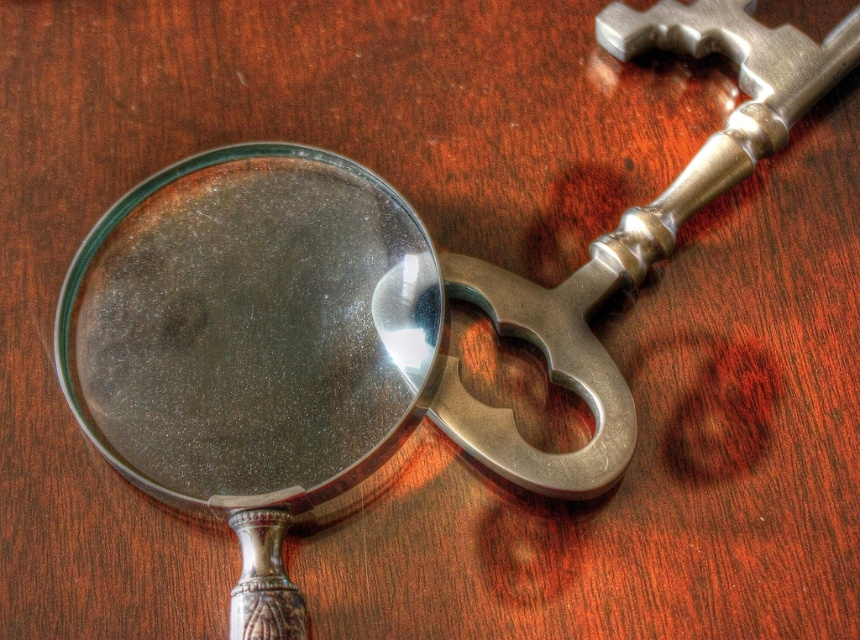
Can you confirm if matte silver magnifying glass at center is shorter than polished metal key at upper right?

Correct, matte silver magnifying glass at center is not as tall as polished metal key at upper right.

From the picture: Does matte silver magnifying glass at center have a larger size compared to polished metal key at upper right?

Actually, matte silver magnifying glass at center might be smaller than polished metal key at upper right.

Where is `matte silver magnifying glass at center`? This screenshot has width=860, height=640. matte silver magnifying glass at center is located at coordinates (243, 328).